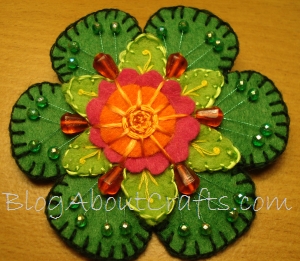
Identify the location of table. (288, 251), (23, 245), (33, 34), (252, 43).